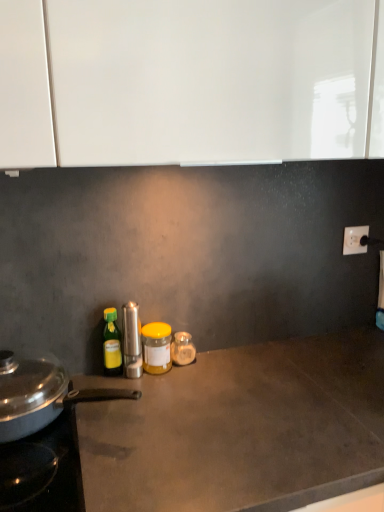
This screenshot has width=384, height=512. Find the location of `free space to the left of yellow matte jar at center, which is the 2th bottle from right to left`. free space to the left of yellow matte jar at center, which is the 2th bottle from right to left is located at coordinates (98, 382).